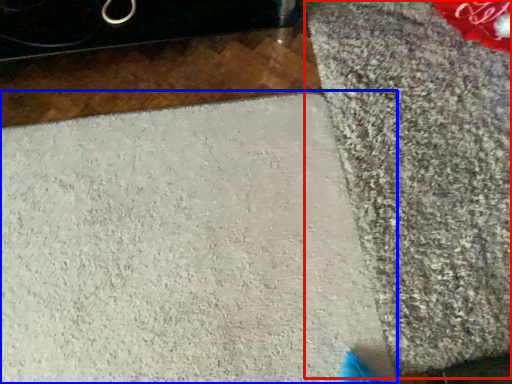
Question: Which object appears farthest to the camera in this image, mat (highlighted by a red box) or concrete (highlighted by a blue box)?

Choices:
 (A) mat
 (B) concrete

Answer: (A)